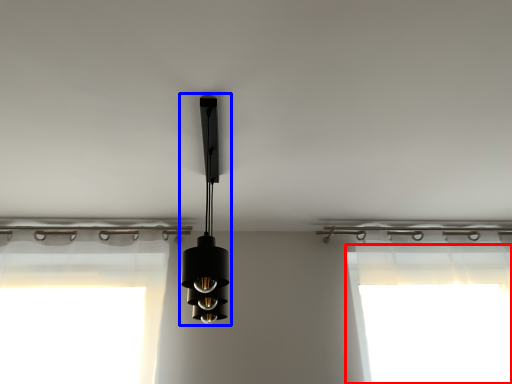
Question: Which of the following is the farthest to the observer, window screen (highlighted by a red box) or lamp (highlighted by a blue box)?

Choices:
 (A) window screen
 (B) lamp

Answer: (A)